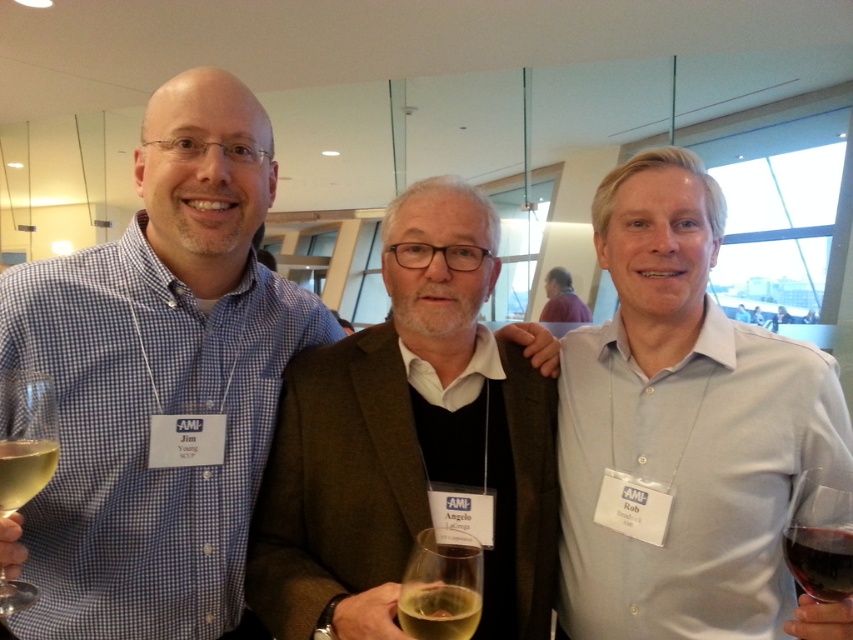
You are at a conference and want to grab a drink from the table behind you. The table is 30 inches away from your current position. There is a translucent glass wine at center on the table. Can you reach it without moving your chair?

The translucent glass wine at center is 29.09 inches from viewer, which is slightly closer than the 30 inches distance to the table. Therefore, you can reach it without moving your chair.

You are standing at the point labeled as point (456, 596) in the image. You want to move to the central figure. Which direction should you move to reach him?

The central figure is located to the left of point (456, 596), so you should move to the left to reach him.

You are standing in front of the three people in the image. Which of the two points, point (341, 609) or point (808, 513), is closer to you?

Point (341, 609) is closer to you because it is further to the viewer than point (808, 513).